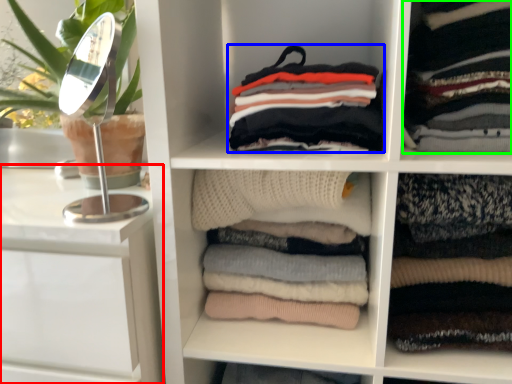
Question: Which object is positioned farthest from vanity (highlighted by a red box)? Select from clothing (highlighted by a blue box) and clothing (highlighted by a green box).

Choices:
 (A) clothing
 (B) clothing

Answer: (B)